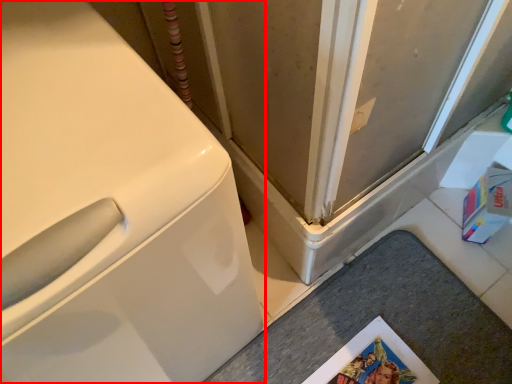
Question: In this image, where is washing machine (annotated by the red box) located relative to counter top?

Choices:
 (A) right
 (B) left

Answer: (B)